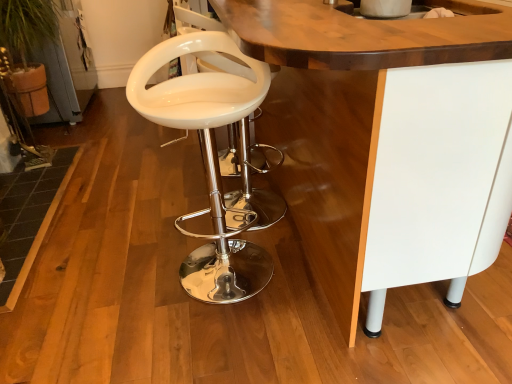
This screenshot has height=384, width=512. What are the coordinates of `free space to the left of white glossy bar stool at center` in the screenshot? It's located at (136, 269).